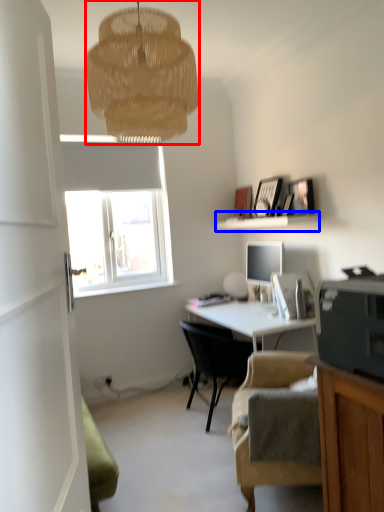
Question: Among these objects, which one is nearest to the camera, lamp (highlighted by a red box) or shelf (highlighted by a blue box)?

Choices:
 (A) lamp
 (B) shelf

Answer: (A)